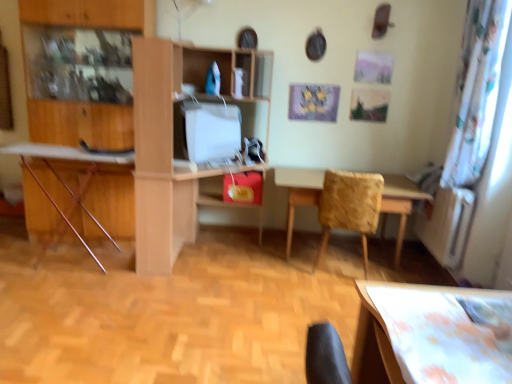
Image resolution: width=512 pixels, height=384 pixels. In order to click on vacant space underneath wooden ironing board at left (from a real-world perspective) in this screenshot , I will do tap(55, 256).